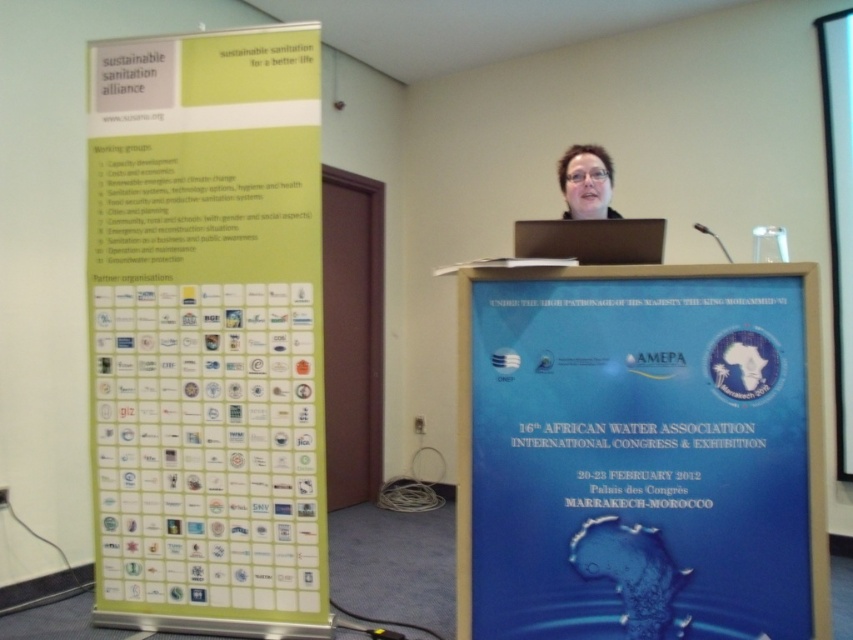
Question: Is green paper poster at left below matte black screen at center?

Choices:
 (A) yes
 (B) no

Answer: (A)

Question: Where is matte black screen at center located in relation to matte black hair at upper center in the image?

Choices:
 (A) above
 (B) below

Answer: (B)

Question: Does matte black screen at center appear on the right side of matte black hair at upper center?

Choices:
 (A) no
 (B) yes

Answer: (A)

Question: Which object is farther from the camera taking this photo?

Choices:
 (A) matte black hair at upper center
 (B) matte black screen at center
 (C) blue glossy poster at center
 (D) green paper poster at left

Answer: (D)

Question: Which point appears closest to the camera in this image?

Choices:
 (A) (663, 291)
 (B) (624, 221)
 (C) (241, 627)

Answer: (A)

Question: Estimate the real-world distances between objects in this image. Which object is farther from the matte black hair at upper center?

Choices:
 (A) green paper poster at left
 (B) blue glossy poster at center

Answer: (A)